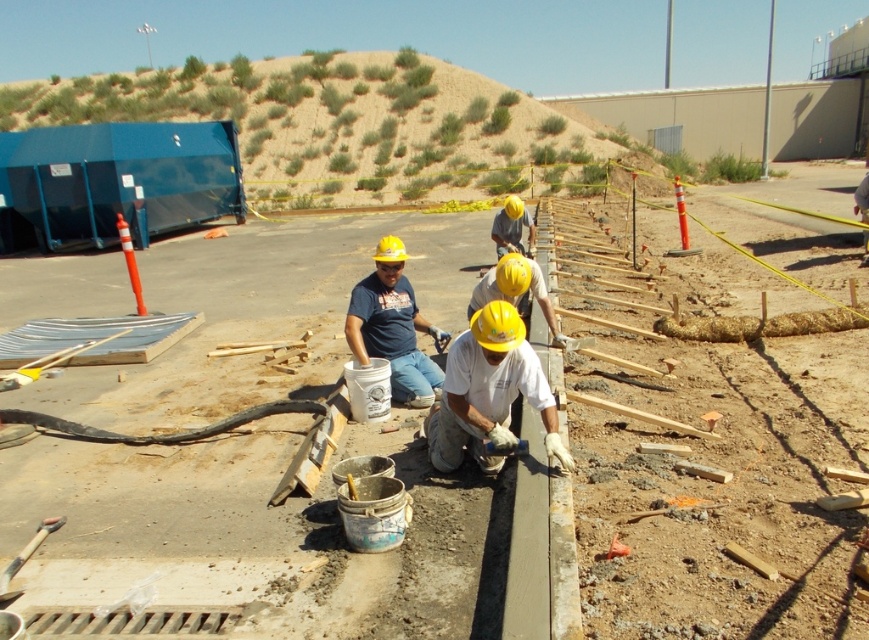
Question: Is white matte hard hat at center to the left of matte yellow hard hat at center from the viewer's perspective?

Choices:
 (A) yes
 (B) no

Answer: (B)

Question: Is white matte hard hat at center to the left of matte yellow hard hat at center from the viewer's perspective?

Choices:
 (A) yes
 (B) no

Answer: (B)

Question: Can you confirm if white matte hard hat at center is smaller than matte yellow hard hat at center?

Choices:
 (A) yes
 (B) no

Answer: (A)